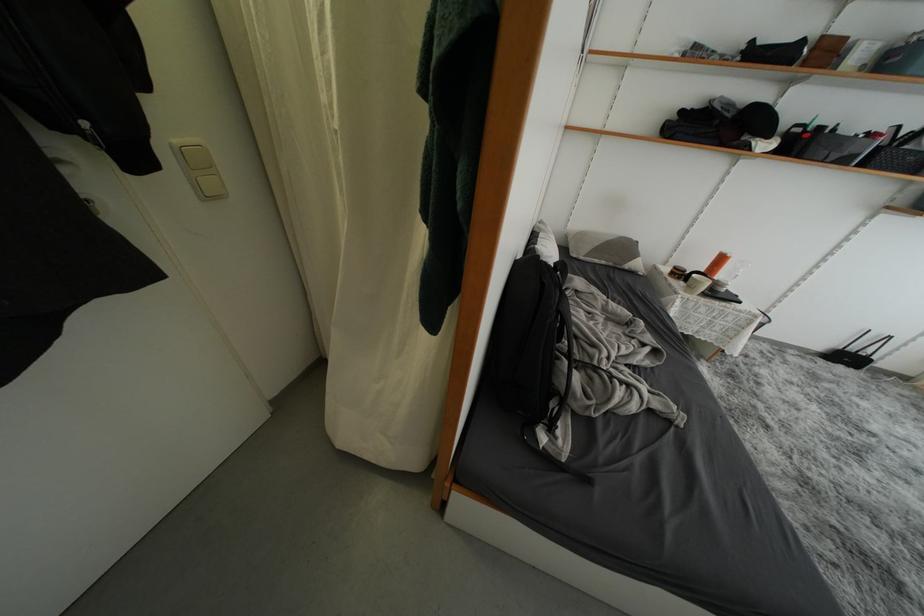
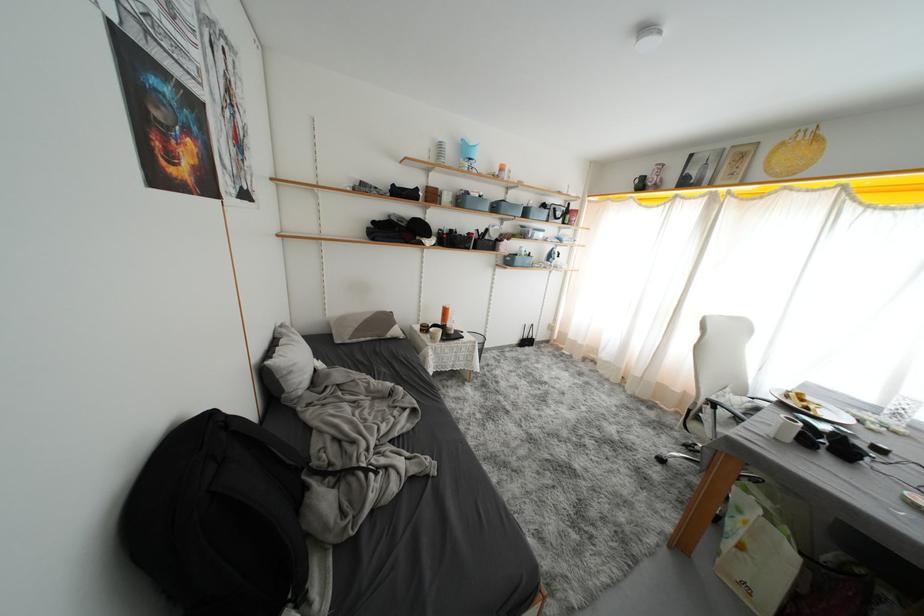
Question: The images are taken continuously from a first-person perspective. In which direction is your viewpoint rotating?

Choices:
 (A) Left
 (B) Right
 (C) Up
 (D) Down

Answer: (B)